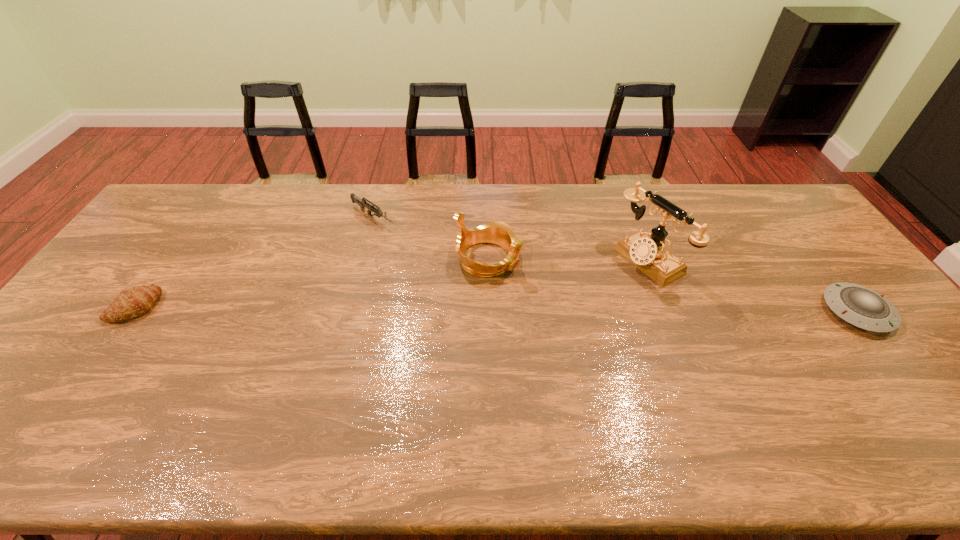
This screenshot has height=540, width=960. I want to click on free area in between the tiara and the farthest object, so click(430, 238).

Identify the location of free space between the third object from left to right and the second object from right to left. (567, 259).

Identify the location of free space between the farthest object and the second tallest object. This screenshot has height=540, width=960. click(430, 238).

Image resolution: width=960 pixels, height=540 pixels. I want to click on blank region between the telephone and the crescent roll, so click(392, 283).

This screenshot has width=960, height=540. Find the location of `vacant space that is in between the telephone and the crescent roll`. vacant space that is in between the telephone and the crescent roll is located at coordinates (392, 283).

Locate an element on the screen. The height and width of the screenshot is (540, 960). unoccupied area between the crescent roll and the tiara is located at coordinates (311, 282).

Identify the location of free point between the telephone and the tiara. (567, 259).

Identify the location of free space between the fourth shortest object and the tallest object. point(567,259).

Identify which object is located as the nearest to the crescent roll. Please provide its 2D coordinates. Your answer should be formatted as a tuple, i.e. [(x, y)], where the tuple contains the x and y coordinates of a point satisfying the conditions above.

[(362, 203)]

Choose which object is the second nearest neighbor to the crescent roll. Please provide its 2D coordinates. Your answer should be formatted as a tuple, i.e. [(x, y)], where the tuple contains the x and y coordinates of a point satisfying the conditions above.

[(499, 233)]